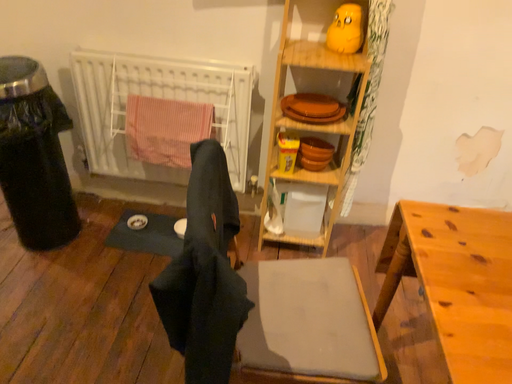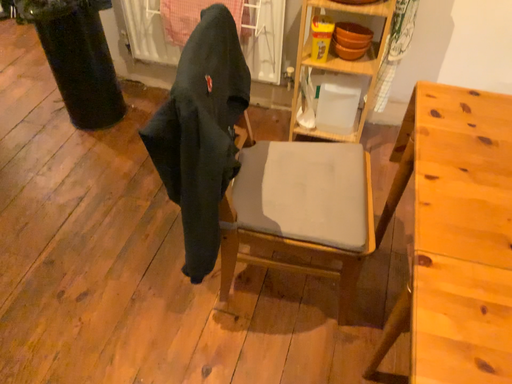
Question: How did the camera likely rotate when shooting the video?

Choices:
 (A) rotated left
 (B) rotated right

Answer: (A)